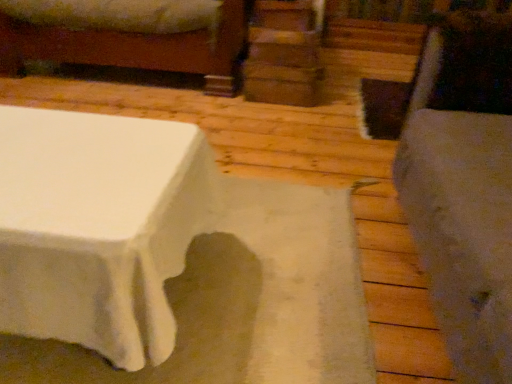
Question: Considering the positions of point (66, 49) and point (415, 157), is point (66, 49) closer or farther from the camera than point (415, 157)?

Choices:
 (A) closer
 (B) farther

Answer: (B)

Question: Is wooden bed frame at upper left wider or thinner than fuzzy gray swivel chair at right?

Choices:
 (A) wide
 (B) thin

Answer: (A)

Question: Considering their positions, is wooden bed frame at upper left located in front of or behind fuzzy gray swivel chair at right?

Choices:
 (A) behind
 (B) front

Answer: (A)

Question: In terms of width, does fuzzy gray swivel chair at right look wider or thinner when compared to wooden bed frame at upper left?

Choices:
 (A) thin
 (B) wide

Answer: (A)

Question: From a real-world perspective, is fuzzy gray swivel chair at right above or below wooden bed frame at upper left?

Choices:
 (A) above
 (B) below

Answer: (A)

Question: Based on their sizes in the image, would you say fuzzy gray swivel chair at right is bigger or smaller than wooden bed frame at upper left?

Choices:
 (A) small
 (B) big

Answer: (A)

Question: From their relative heights in the image, would you say fuzzy gray swivel chair at right is taller or shorter than wooden bed frame at upper left?

Choices:
 (A) tall
 (B) short

Answer: (A)